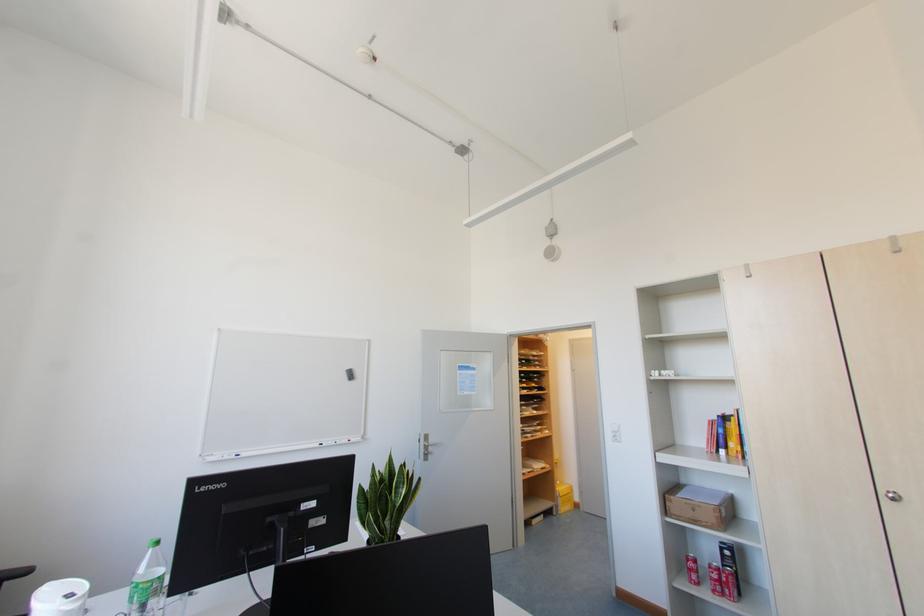
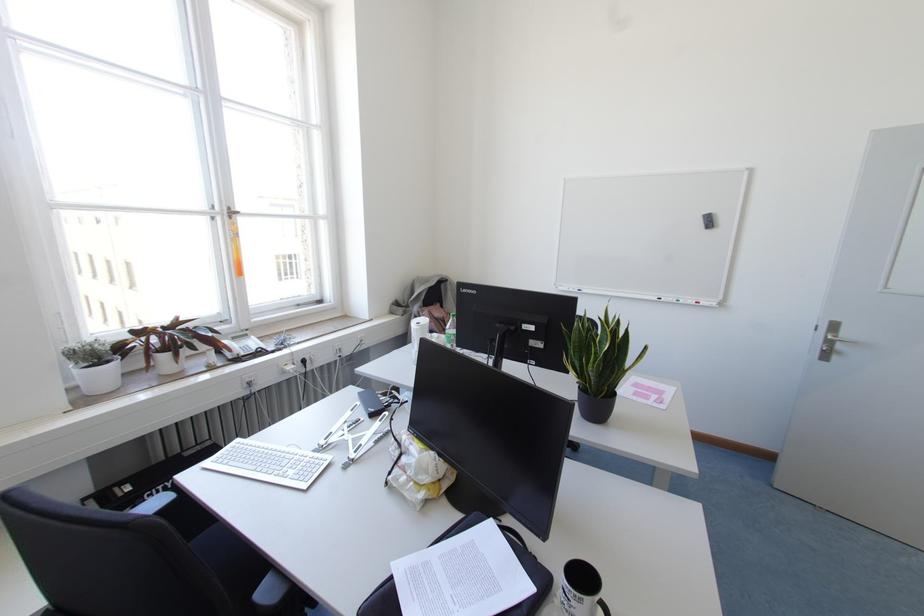
The point at (321,444) is marked in the first image. Where is the corresponding point in the second image?

(659, 299)